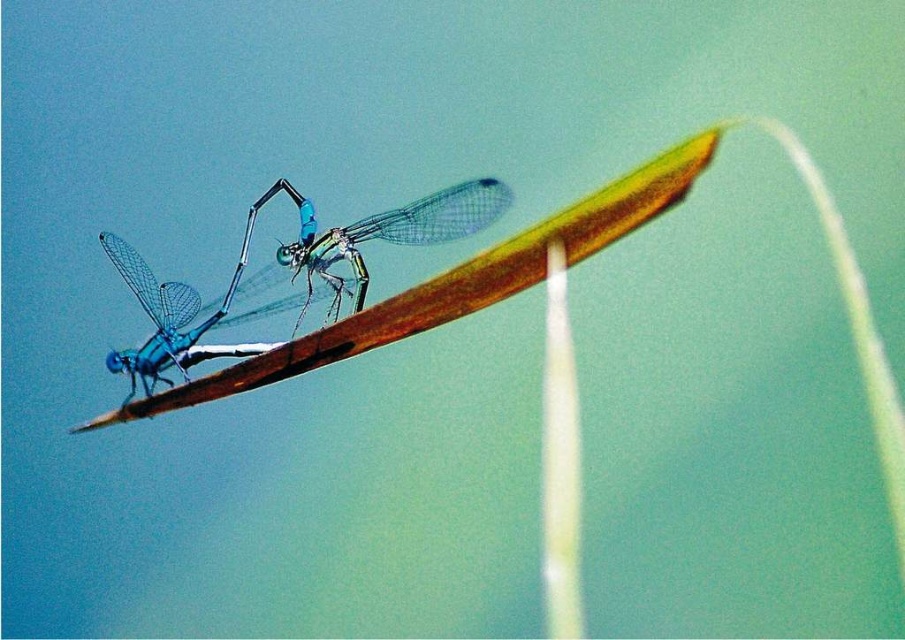
You are an entomologist examining two dragonflies on a blade of grass. You have a magnifying glass and need to observe the translucent glass dragonfly at center and the translucent blue dragonfly at center. Which dragonfly should you focus your magnifying glass on first to ensure you can see both without moving the blade of grass?

You should focus on the translucent glass dragonfly at center first because it is closer to you than the translucent blue dragonfly at center, allowing you to observe both without needing to adjust the blade of grass.

You are holding a camera and want to take a photo of the translucent glass dragonfly at center. If you move 2 feet closer to it, how far will you be from the dragonfly?

The translucent glass dragonfly at center and camera are 4.44 feet apart. If you move 2 feet closer, the distance becomes 4.44 minus 2 equals 2.44 feet. So you will be 2.44 feet away from the dragonfly.

You are a nature photographer aiming to capture a clear photo of both dragonflies. Since the dragonflies are translucent, you need to ensure proper lighting. Which dragonfly, the translucent glass dragonfly at center or the translucent blue dragonfly at center, is easier to photograph because it is not obscured by the other?

The translucent glass dragonfly at center is positioned over the translucent blue dragonfly at center, so the translucent blue dragonfly at center is easier to photograph because it is not obscured by the other.